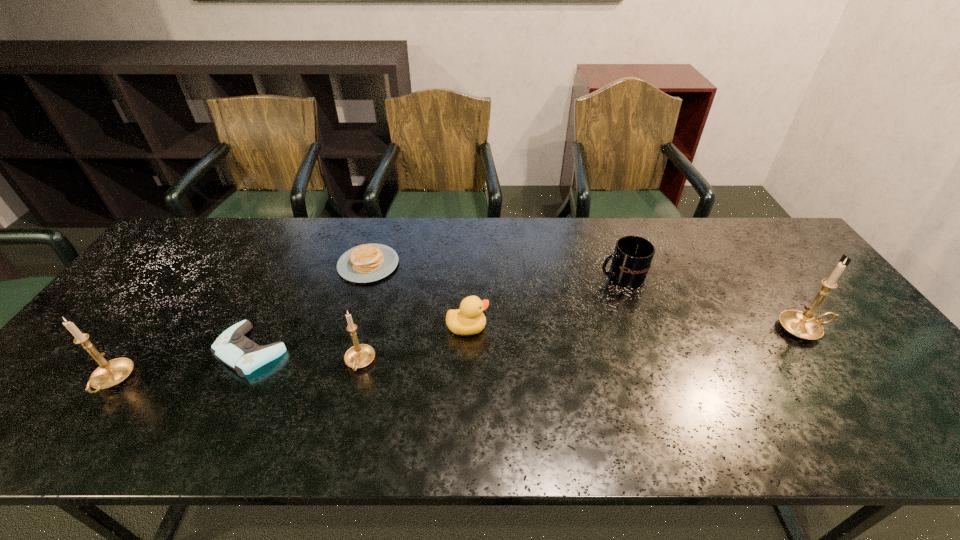
Locate an element on the screen. The height and width of the screenshot is (540, 960). vacant space located 0.080m on the handle side of the fifth shortest object is located at coordinates (348, 409).

The width and height of the screenshot is (960, 540). In order to click on vacant space located on the handle side of the farthest candle holder in this screenshot , I will do `click(852, 329)`.

Where is `blank area located with the handle on the side of the sixth object from left to right`? This screenshot has width=960, height=540. blank area located with the handle on the side of the sixth object from left to right is located at coordinates (578, 277).

The width and height of the screenshot is (960, 540). I want to click on vacant area situated with the handle on the side of the sixth object from left to right, so click(x=483, y=277).

Where is `vacant space situated 0.300m with the handle on the side of the sixth object from left to right`? vacant space situated 0.300m with the handle on the side of the sixth object from left to right is located at coordinates (496, 277).

You are a GUI agent. You are given a task and a screenshot of the screen. Output one action in this format:
    pyautogui.click(x=<x>, y=<y>)
    Task: Click on the vacant space located at the beak of the duck
    The height and width of the screenshot is (540, 960).
    Given the screenshot: What is the action you would take?
    pyautogui.click(x=617, y=327)

You are a GUI agent. You are given a task and a screenshot of the screen. Output one action in this format:
    pyautogui.click(x=<x>, y=<y>)
    Task: Click on the vacant point located 0.180m on the left of the pancake
    The width and height of the screenshot is (960, 540).
    Given the screenshot: What is the action you would take?
    pyautogui.click(x=279, y=265)

At what (x,y) coordinates should I click in order to perform the action: click on vacant space located 0.300m on the left of the control. Please return your answer as a coordinate pair (x, y). Looking at the image, I should click on (97, 350).

This screenshot has height=540, width=960. I want to click on object that is at the far edge, so click(x=364, y=263).

Locate an element on the screen. Image resolution: width=960 pixels, height=540 pixels. control that is at the near edge is located at coordinates coord(234,349).